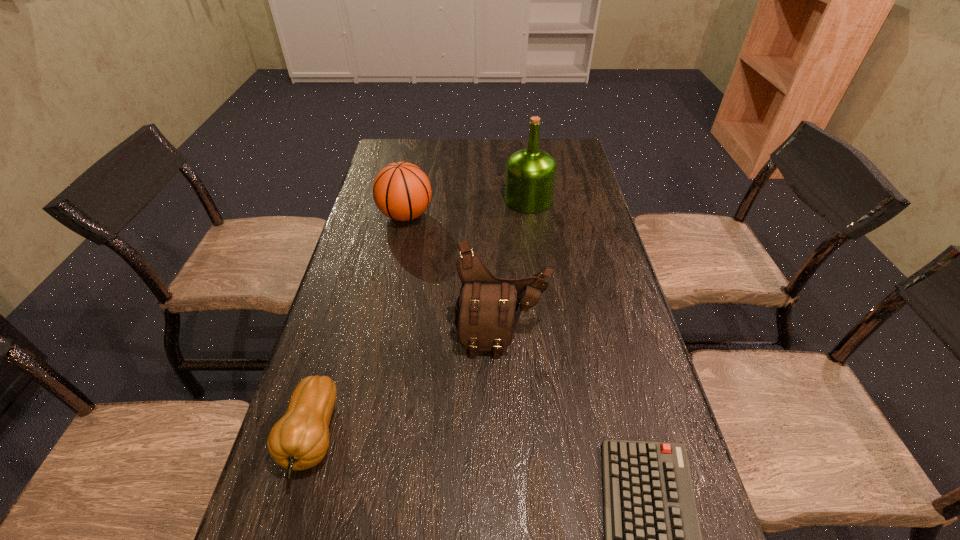
Identify the location of vacant point located between the third farthest object and the third shortest object. (453, 276).

Where is `free area in between the olive oil and the third tallest object`? The height and width of the screenshot is (540, 960). free area in between the olive oil and the third tallest object is located at coordinates (468, 207).

Locate an element on the screen. The image size is (960, 540). vacant area between the olive oil and the fourth tallest object is located at coordinates (420, 318).

Locate an element on the screen. The image size is (960, 540). object that stands as the closest to the fourth tallest object is located at coordinates (487, 310).

This screenshot has width=960, height=540. Identify the location of object that is the fourth closest to the shortest object. (530, 176).

The height and width of the screenshot is (540, 960). Find the location of `vacant point that satisfies the following two spatial constraints: 1. on the back side of the basketball; 2. on the left side of the olive oil`. vacant point that satisfies the following two spatial constraints: 1. on the back side of the basketball; 2. on the left side of the olive oil is located at coordinates (409, 200).